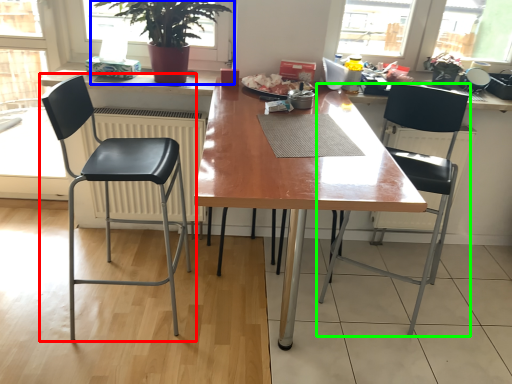
Question: Based on their relative distances, which object is nearer to chair (highlighted by a red box)? Choose from houseplant (highlighted by a blue box) and chair (highlighted by a green box).

Choices:
 (A) houseplant
 (B) chair

Answer: (A)